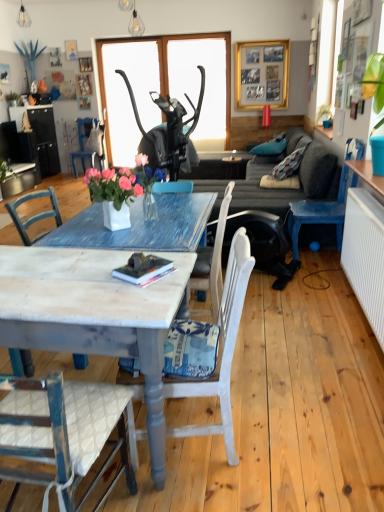
Image resolution: width=384 pixels, height=512 pixels. I want to click on transparent plastic window screen at center, the second window screen viewed from the right, so click(x=128, y=94).

What is the approximate width of black matte mask at center, placed as the 1th window screen when sorted from right to left?

2.70 inches.

You are a GUI agent. You are given a task and a screenshot of the screen. Output one action in this format:
    pyautogui.click(x=<x>, y=<y>)
    Task: Click on the black matte mask at center, which appears as the 2th window screen when viewed from the left
    
    Given the screenshot: What is the action you would take?
    199,82

From the picture: How much space does white painted wood chair at lower center, which is the 1th chair from front to back, occupy horizontally?

The width of white painted wood chair at lower center, which is the 1th chair from front to back, is 21.59 inches.

This screenshot has width=384, height=512. What do you see at coordinates (265, 174) in the screenshot?
I see `dark gray fabric couch at center` at bounding box center [265, 174].

In order to click on dark gray fabric couch at center in this screenshot , I will do (265, 174).

The image size is (384, 512). In order to click on transparent plastic window screen at center, which is the first window screen from left to right in this screenshot , I will do `click(128, 94)`.

Considering the relative sizes of transparent plastic window screen at center, which is the first window screen from left to right, and white painted wood chair at lower center, which ranks as the 3th chair in top-to-bottom order, in the image provided, is transparent plastic window screen at center, which is the first window screen from left to right, smaller than white painted wood chair at lower center, which ranks as the 3th chair in top-to-bottom order,?

Indeed, transparent plastic window screen at center, which is the first window screen from left to right, has a smaller size compared to white painted wood chair at lower center, which ranks as the 3th chair in top-to-bottom order.

Is transparent plastic window screen at center, the second window screen viewed from the right, oriented towards white painted wood chair at lower center, the first chair positioned from the bottom?

Yes, transparent plastic window screen at center, the second window screen viewed from the right, faces towards white painted wood chair at lower center, the first chair positioned from the bottom.

Is transparent plastic window screen at center, the second window screen viewed from the right, positioned far away from white painted wood chair at lower center, which is the third chair in back-to-front order?

Yes, transparent plastic window screen at center, the second window screen viewed from the right, and white painted wood chair at lower center, which is the third chair in back-to-front order, are located far from each other.

This screenshot has width=384, height=512. I want to click on lamp that is the 1st one when counting backward from the blue painted wood chair at lower right, which is the second chair from bottom to top, so click(x=132, y=18).

Is metallic pendant light at upper center, the 2th lamp when ordered from left to right, not close to blue painted wood chair at lower right, which is the second chair from bottom to top?

metallic pendant light at upper center, the 2th lamp when ordered from left to right, is far away from blue painted wood chair at lower right, which is the second chair from bottom to top.

Is point (138, 28) positioned before point (293, 202)?

No.

From the image's perspective, between metallic pendant light at upper center, which ranks as the 2th lamp in back-to-front order, and blue painted wood chair at lower right, which is the second chair from bottom to top, who is located below?

blue painted wood chair at lower right, which is the second chair from bottom to top, appears lower in the image.

Considering the relative sizes of black matte mask at center, which appears as the 2th window screen when viewed from the left, and distressed white marble coffee table at center in the image provided, is black matte mask at center, which appears as the 2th window screen when viewed from the left, wider than distressed white marble coffee table at center?

No, black matte mask at center, which appears as the 2th window screen when viewed from the left, is not wider than distressed white marble coffee table at center.

Which object is further away from the camera taking this photo, black matte mask at center, which appears as the 2th window screen when viewed from the left, or distressed white marble coffee table at center?

Positioned behind is black matte mask at center, which appears as the 2th window screen when viewed from the left.

Is there a large distance between black matte mask at center, which appears as the 2th window screen when viewed from the left, and distressed white marble coffee table at center?

black matte mask at center, which appears as the 2th window screen when viewed from the left, is far away from distressed white marble coffee table at center.

Which is less distant, (176, 78) or (50, 278)?

Point (176, 78) appears to be farther away from the viewer than point (50, 278).

Considering the positions of objects metallic pendant light at upper center, which ranks as the 2th lamp in back-to-front order, and black matte mask at center, placed as the 1th window screen when sorted from right to left, in the image provided, who is in front, metallic pendant light at upper center, which ranks as the 2th lamp in back-to-front order, or black matte mask at center, placed as the 1th window screen when sorted from right to left,?

metallic pendant light at upper center, which ranks as the 2th lamp in back-to-front order, is in front.

Considering the sizes of objects metallic pendant light at upper center, the first lamp when ordered from bottom to top, and black matte mask at center, which appears as the 2th window screen when viewed from the left, in the image provided, who is wider, metallic pendant light at upper center, the first lamp when ordered from bottom to top, or black matte mask at center, which appears as the 2th window screen when viewed from the left,?

metallic pendant light at upper center, the first lamp when ordered from bottom to top.

How distant is metallic pendant light at upper center, positioned as the 2th lamp in top-to-bottom order, from black matte mask at center, placed as the 1th window screen when sorted from right to left?

metallic pendant light at upper center, positioned as the 2th lamp in top-to-bottom order, is 3.37 feet away from black matte mask at center, placed as the 1th window screen when sorted from right to left.

Visually, is metallic pendant light at upper center, marked as the first lamp in a right-to-left arrangement, positioned to the left or to the right of black matte mask at center, placed as the 1th window screen when sorted from right to left?

Clearly, metallic pendant light at upper center, marked as the first lamp in a right-to-left arrangement, is on the left of black matte mask at center, placed as the 1th window screen when sorted from right to left, in the image.

Would you say dark gray fabric couch at center is outside black matte mask at center, placed as the 1th window screen when sorted from right to left?

Yes, dark gray fabric couch at center is located beyond the bounds of black matte mask at center, placed as the 1th window screen when sorted from right to left.

Locate an element on the screen. The image size is (384, 512). studio couch below the black matte mask at center, which appears as the 2th window screen when viewed from the left (from the image's perspective) is located at coordinates (265, 174).

Is dark gray fabric couch at center oriented away from black matte mask at center, placed as the 1th window screen when sorted from right to left?

dark gray fabric couch at center is not turned away from black matte mask at center, placed as the 1th window screen when sorted from right to left.

Is the surface of dark gray fabric couch at center in direct contact with black matte mask at center, placed as the 1th window screen when sorted from right to left?

They are not placed beside each other.

Find the location of `chair that is the 2nd object to the left of the dark gray fabric couch at center, starting at the anchor`. chair that is the 2nd object to the left of the dark gray fabric couch at center, starting at the anchor is located at coordinates (89, 144).

In the image, is blue painted wood chair at left, placed as the 1th chair when sorted from left to right, positioned in front of or behind dark gray fabric couch at center?

Clearly, blue painted wood chair at left, placed as the 1th chair when sorted from left to right, is behind dark gray fabric couch at center.

Consider the image. Who is shorter, blue painted wood chair at left, placed as the 1th chair when sorted from left to right, or dark gray fabric couch at center?

dark gray fabric couch at center.

From a real-world perspective, who is located lower, blue painted wood chair at left, which appears as the 3th chair when ordered from the bottom, or dark gray fabric couch at center?

dark gray fabric couch at center.

From the picture: Is white painted wood chair at lower center, which is the third chair in back-to-front order, surrounded by metallic pendant light at upper center, marked as the first lamp in a right-to-left arrangement?

Definitely not — white painted wood chair at lower center, which is the third chair in back-to-front order, is not inside metallic pendant light at upper center, marked as the first lamp in a right-to-left arrangement.

Measure the distance between metallic pendant light at upper center, the 2th lamp when ordered from left to right, and white painted wood chair at lower center, which ranks as the 3th chair in top-to-bottom order.

metallic pendant light at upper center, the 2th lamp when ordered from left to right, is 5.45 meters away from white painted wood chair at lower center, which ranks as the 3th chair in top-to-bottom order.

Considering the points (130, 18) and (224, 315), which point is in front, point (130, 18) or point (224, 315)?

The point (224, 315) is closer to the camera.

Between metallic pendant light at upper center, which ranks as the 2th lamp in back-to-front order, and white painted wood chair at lower center, which ranks as the 3th chair in top-to-bottom order, which one has smaller size?

With smaller size is metallic pendant light at upper center, which ranks as the 2th lamp in back-to-front order.

Find the location of `the 3rd chair directly beneath the transparent plastic window screen at center, which is the first window screen from left to right (from a real-world perspective)`. the 3rd chair directly beneath the transparent plastic window screen at center, which is the first window screen from left to right (from a real-world perspective) is located at coordinates (221, 349).

Locate an element on the screen. The width and height of the screenshot is (384, 512). the 1st lamp above the blue painted wood chair at lower right, the second chair viewed from the back (from the image's perspective) is located at coordinates (132, 18).

Looking at the image, which one is located closer to blue painted wood chair at lower right, the second chair viewed from the back, black matte mask at center, placed as the 1th window screen when sorted from right to left, or white painted wood chair at lower center, which ranks as the 3th chair in top-to-bottom order?

white painted wood chair at lower center, which ranks as the 3th chair in top-to-bottom order, is positioned closer to the anchor blue painted wood chair at lower right, the second chair viewed from the back.

Based on their spatial positions, is metallic wire bulb at upper center, which is the first lamp from top to bottom, or hardcover book at center closer to blue painted wood chair at left, acting as the 1th chair starting from the top?

metallic wire bulb at upper center, which is the first lamp from top to bottom, lies closer to blue painted wood chair at left, acting as the 1th chair starting from the top, than the other object.

Consider the image. Estimate the real-world distances between objects in this image. Which object is closer to transparent plastic window screen at center, the second window screen viewed from the right, blue painted wood chair at left, the first chair when ordered from back to front, or white painted wood chair at lower center, the first chair positioned from the bottom?

blue painted wood chair at left, the first chair when ordered from back to front, lies closer to transparent plastic window screen at center, the second window screen viewed from the right, than the other object.

Estimate the real-world distances between objects in this image. Which object is closer to metallic pendant light at upper center, the first lamp when ordered from bottom to top, black matte mask at center, which appears as the 2th window screen when viewed from the left, or dark gray fabric couch at center?

Among the two, black matte mask at center, which appears as the 2th window screen when viewed from the left, is located nearer to metallic pendant light at upper center, the first lamp when ordered from bottom to top.

Based on their spatial positions, is hardcover book at center or white painted wood chair at lower center, which is the 1th chair from front to back, further from dark gray fabric couch at center?

Among the two, hardcover book at center is located further to dark gray fabric couch at center.

Considering their positions, is metallic wire bulb at upper center, which is the first lamp from top to bottom, positioned further to blue painted wood chair at left, which appears as the third chair when viewed from the right, than white painted wood chair at lower center, the 2th chair from the left?

white painted wood chair at lower center, the 2th chair from the left.

Estimate the real-world distances between objects in this image. Which object is further from transparent plastic window screen at center, the second window screen viewed from the right, blue painted wood chair at left, which appears as the third chair when viewed from the right, or hardcover book at center?

hardcover book at center lies further to transparent plastic window screen at center, the second window screen viewed from the right, than the other object.

When comparing their distances from distressed white marble coffee table at center, does gold metallic picture frame at upper center or transparent plastic window screen at center, which is the first window screen from left to right, seem further?

Among the two, gold metallic picture frame at upper center is located further to distressed white marble coffee table at center.

The image size is (384, 512). I want to click on chair positioned between dark gray fabric couch at center and transparent plastic window screen at center, which is the first window screen from left to right, from near to far, so click(x=89, y=144).

What are the coordinates of `studio couch between distressed white marble coffee table at center and gold metallic picture frame at upper center along the z-axis` in the screenshot? It's located at (265, 174).

Where is `book positioned between distressed white marble coffee table at center and metallic wire bulb at upper center, which is the second lamp from right to left, from near to far`? The height and width of the screenshot is (512, 384). book positioned between distressed white marble coffee table at center and metallic wire bulb at upper center, which is the second lamp from right to left, from near to far is located at coordinates (142, 268).

I want to click on book between white painted wood chair at lower center, which ranks as the 3th chair in top-to-bottom order, and metallic pendant light at upper center, the 1th lamp in the front-to-back sequence, along the z-axis, so click(x=142, y=268).